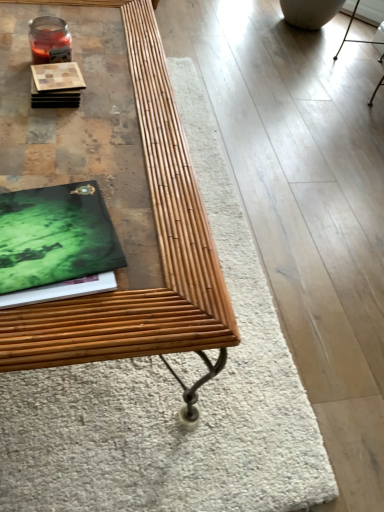
Where is `free point below green matte book at left (from a real-world perspective)`? free point below green matte book at left (from a real-world perspective) is located at coordinates (42, 239).